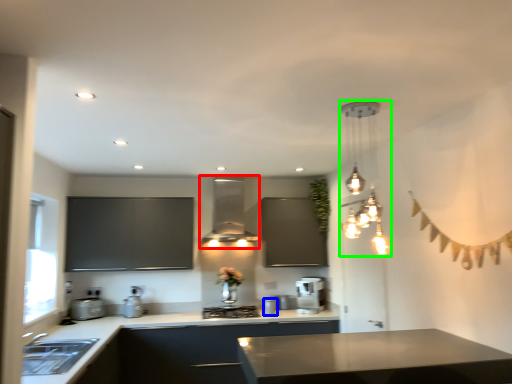
Question: Which object is positioned farthest from exhaust hood (highlighted by a red box)? Select from appliance (highlighted by a blue box) and lamp (highlighted by a green box).

Choices:
 (A) appliance
 (B) lamp

Answer: (B)